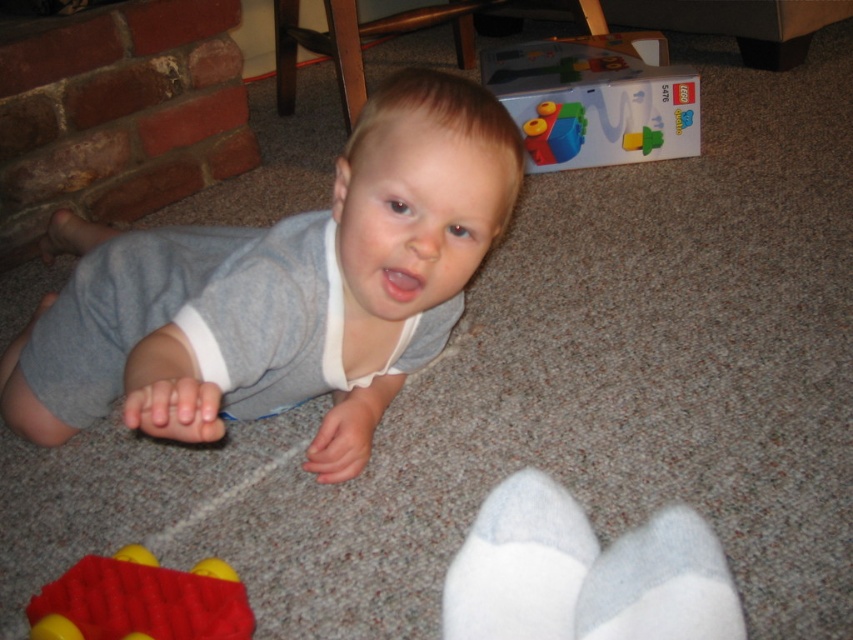
You are a toy organizer trying to arrange the white soft socks at lower center and the translucent plastic blocks at upper center. Based on their positions in the image, which object should you place first if you want to start organizing from the closest to the farthest?

The white soft socks at lower center should be placed first because they are closer to the viewer than the translucent plastic blocks at upper center.

You are a photographer trying to capture a closeup of the white soft socks at lower center. The camera you are using has a minimum focusing distance of 30 inches. Can you take the photo without moving the camera or the socks?

The white soft socks at lower center and camera are 30.13 inches apart, which is just over the camera minimum focusing distance of 30 inches. Therefore, you can take the photo without moving the camera or the socks.